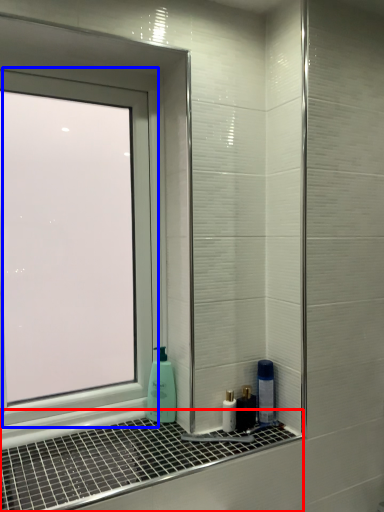
Question: Among these objects, which one is nearest to the camera, window sill (highlighted by a red box) or window (highlighted by a blue box)?

Choices:
 (A) window sill
 (B) window

Answer: (A)